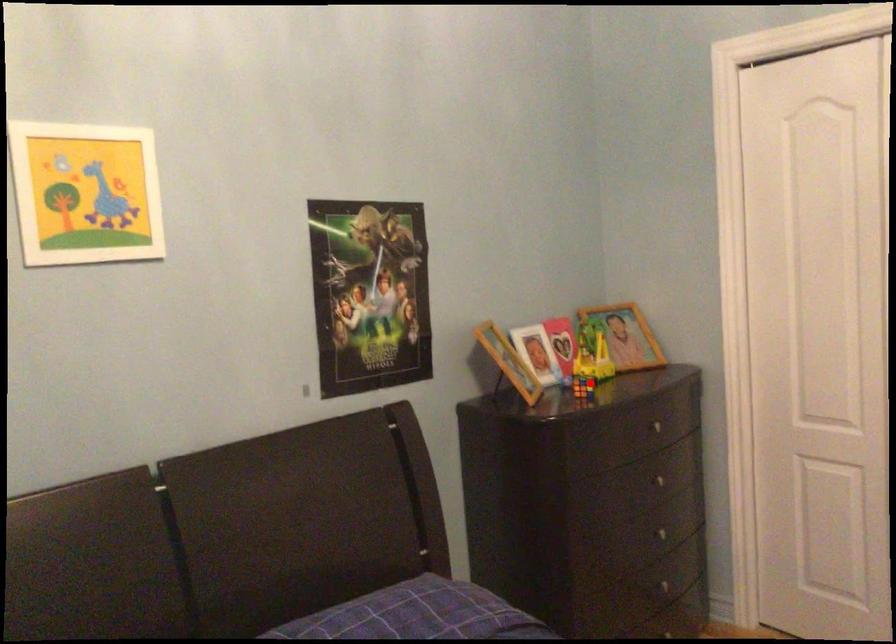
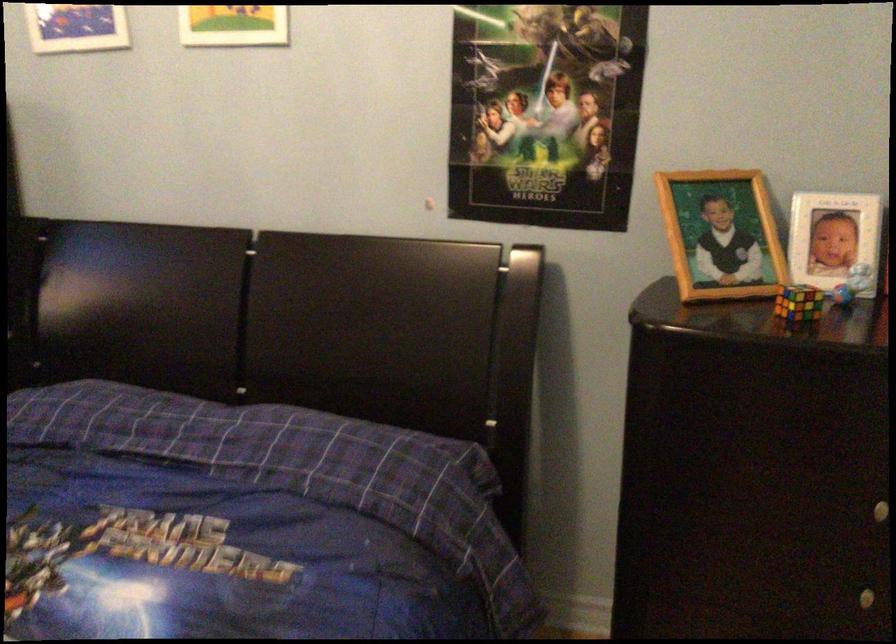
Find the pixel in the second image that matches the highlighted location in the first image.

(798, 303)